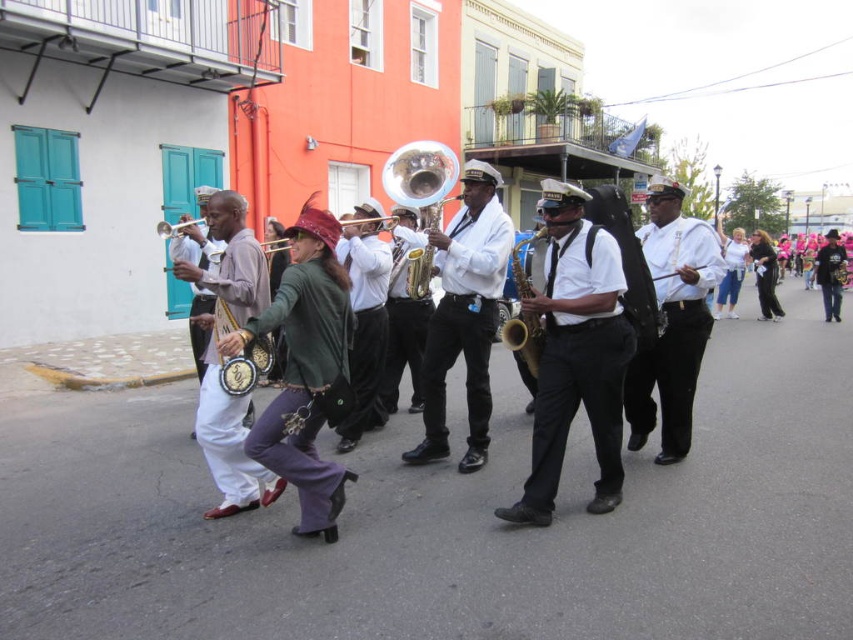
Who is more distant from viewer, (403, 353) or (286, 244)?

The point (286, 244) is more distant.

Does shiny gold saxophone at center appear over gold brass trumpet at center?

Actually, shiny gold saxophone at center is below gold brass trumpet at center.

Measure the distance between point [399,376] and camera.

21.89 feet

You are a GUI agent. You are given a task and a screenshot of the screen. Output one action in this format:
    pyautogui.click(x=<x>, y=<y>)
    Task: Click on the shiny gold saxophone at center
    This screenshot has height=640, width=853.
    Given the screenshot: What is the action you would take?
    pyautogui.click(x=404, y=328)

Who is positioned more to the left, white matte uniform at center or brushed brass trumpet at center?

brushed brass trumpet at center is more to the left.

Is white matte uniform at center taller than brushed brass trumpet at center?

Correct, white matte uniform at center is much taller as brushed brass trumpet at center.

Who is more distant from viewer, (424, 420) or (175, 230)?

The point (175, 230) is more distant.

The image size is (853, 640). I want to click on white matte uniform at center, so click(x=463, y=314).

Is point (677, 371) farther from viewer compared to point (178, 225)?

No, it is in front of (178, 225).

Who is more forward, (660, 394) or (204, 220)?

Positioned in front is point (204, 220).

Locate an element on the screen. This screenshot has width=853, height=640. white uniform at center is located at coordinates (672, 321).